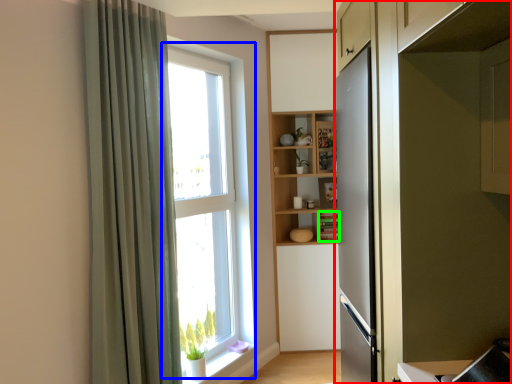
Question: Which is farther away from cabinetry (highlighted by a red box)? window (highlighted by a blue box) or cabinet (highlighted by a green box)?

Choices:
 (A) window
 (B) cabinet

Answer: (B)